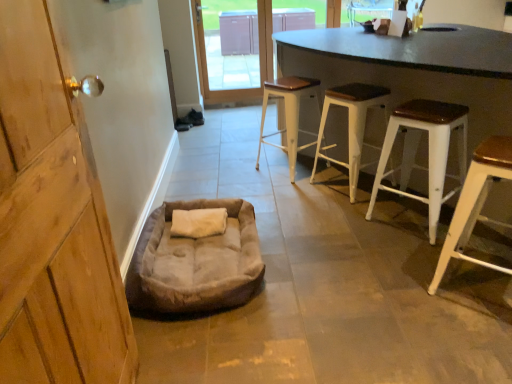
Question: From a real-world perspective, is transparent glass door at upper center physically above wooden door handle at left?

Choices:
 (A) no
 (B) yes

Answer: (A)

Question: Is transparent glass door at upper center thinner than wooden door handle at left?

Choices:
 (A) no
 (B) yes

Answer: (A)

Question: Are transparent glass door at upper center and wooden door handle at left located far from each other?

Choices:
 (A) no
 (B) yes

Answer: (B)

Question: Is transparent glass door at upper center at the right side of wooden door handle at left?

Choices:
 (A) yes
 (B) no

Answer: (A)

Question: From a real-world perspective, is transparent glass door at upper center located beneath wooden door handle at left?

Choices:
 (A) no
 (B) yes

Answer: (B)

Question: Considering the positions of white wood stool at center, which appears as the 2th stool when viewed from the back, and black matte table at center in the image, is white wood stool at center, which appears as the 2th stool when viewed from the back, wider or thinner than black matte table at center?

Choices:
 (A) thin
 (B) wide

Answer: (A)

Question: Relative to black matte table at center, is white wood stool at center, which is counted as the third stool, starting from the front, in front or behind?

Choices:
 (A) front
 (B) behind

Answer: (B)

Question: From the image's perspective, is white wood stool at center, which appears as the 2th stool when viewed from the back, located above or below black matte table at center?

Choices:
 (A) below
 (B) above

Answer: (A)

Question: Choose the correct answer: Is white wood stool at center, which is counted as the third stool, starting from the front, inside black matte table at center or outside it?

Choices:
 (A) inside
 (B) outside

Answer: (A)

Question: From the image's perspective, relative to white metal stool at center, placed as the 4th stool when sorted from front to back, is white wood stool at right, placed as the 1th stool when sorted from front to back, above or below?

Choices:
 (A) below
 (B) above

Answer: (A)

Question: From a real-world perspective, is white wood stool at right, placed as the 1th stool when sorted from front to back, positioned above or below white metal stool at center, the 1th stool viewed from the back?

Choices:
 (A) below
 (B) above

Answer: (B)

Question: Looking at their shapes, would you say white wood stool at right, which is counted as the fourth stool, starting from the back, is wider or thinner than white metal stool at center, the 1th stool viewed from the back?

Choices:
 (A) wide
 (B) thin

Answer: (B)

Question: Is white wood stool at right, which is counted as the fourth stool, starting from the back, taller or shorter than white metal stool at center, placed as the 4th stool when sorted from front to back?

Choices:
 (A) short
 (B) tall

Answer: (A)

Question: From the image's perspective, is white metal stool at center, placed as the 4th stool when sorted from front to back, located above or below transparent glass door at upper center?

Choices:
 (A) below
 (B) above

Answer: (A)

Question: Is white metal stool at center, placed as the 4th stool when sorted from front to back, situated inside transparent glass door at upper center or outside?

Choices:
 (A) outside
 (B) inside

Answer: (A)